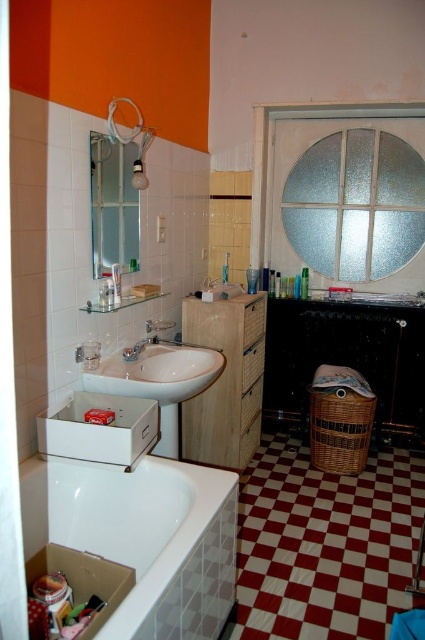
Who is more forward, (240, 300) or (135, 352)?

Point (135, 352) is in front.

In order to click on wooden cabinet at center in this screenshot , I will do `click(226, 380)`.

This screenshot has height=640, width=425. Describe the element at coordinates (144, 538) in the screenshot. I see `white glossy bathtub at lower left` at that location.

Does white glossy bathtub at lower left have a lesser height compared to clear glass mirror at upper left?

Yes.

Who is more distant from viewer, (180,605) or (104,132)?

Positioned behind is point (104,132).

You are a GUI agent. You are given a task and a screenshot of the screen. Output one action in this format:
    pyautogui.click(x=<x>, y=<y>)
    Task: Click on the white glossy bathtub at lower left
    This screenshot has height=640, width=425.
    Given the screenshot: What is the action you would take?
    pyautogui.click(x=144, y=538)

Which of these two, clear glass mirror at upper left or brushed metal faucet at sink left, stands shorter?

With less height is brushed metal faucet at sink left.

Where is `clear glass mirror at upper left`? This screenshot has width=425, height=640. clear glass mirror at upper left is located at coordinates (113, 204).

Which is in front, point (99, 260) or point (146, 337)?

Point (99, 260) is in front.

This screenshot has height=640, width=425. I want to click on clear glass mirror at upper left, so click(113, 204).